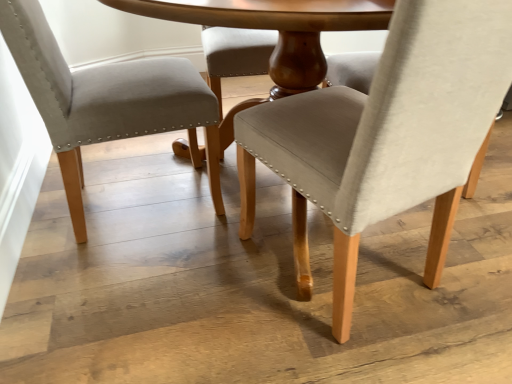
Question: Looking at the image, does matte beige fabric chair at center, which is counted as the 2th chair, starting from the left, seem bigger or smaller compared to beige fabric chair at left, which is the 2th chair from right to left?

Choices:
 (A) big
 (B) small

Answer: (A)

Question: In the image, is matte beige fabric chair at center, marked as the 1th chair in a right-to-left arrangement, positioned in front of or behind beige fabric chair at left, which is the 2th chair from right to left?

Choices:
 (A) behind
 (B) front

Answer: (B)

Question: Is point (333, 291) closer or farther from the camera than point (115, 107)?

Choices:
 (A) closer
 (B) farther

Answer: (A)

Question: Based on their sizes in the image, would you say beige fabric chair at left, the first chair positioned from the left, is bigger or smaller than matte beige fabric chair at center, marked as the 1th chair in a right-to-left arrangement?

Choices:
 (A) big
 (B) small

Answer: (B)

Question: Is beige fabric chair at left, the first chair positioned from the left, taller or shorter than matte beige fabric chair at center, which is counted as the 2th chair, starting from the left?

Choices:
 (A) tall
 (B) short

Answer: (B)

Question: Is beige fabric chair at left, which is the 2th chair from right to left, situated inside matte beige fabric chair at center, marked as the 1th chair in a right-to-left arrangement, or outside?

Choices:
 (A) inside
 (B) outside

Answer: (B)

Question: From the image's perspective, is beige fabric chair at left, which is the 2th chair from right to left, located above or below matte beige fabric chair at center, marked as the 1th chair in a right-to-left arrangement?

Choices:
 (A) above
 (B) below

Answer: (A)